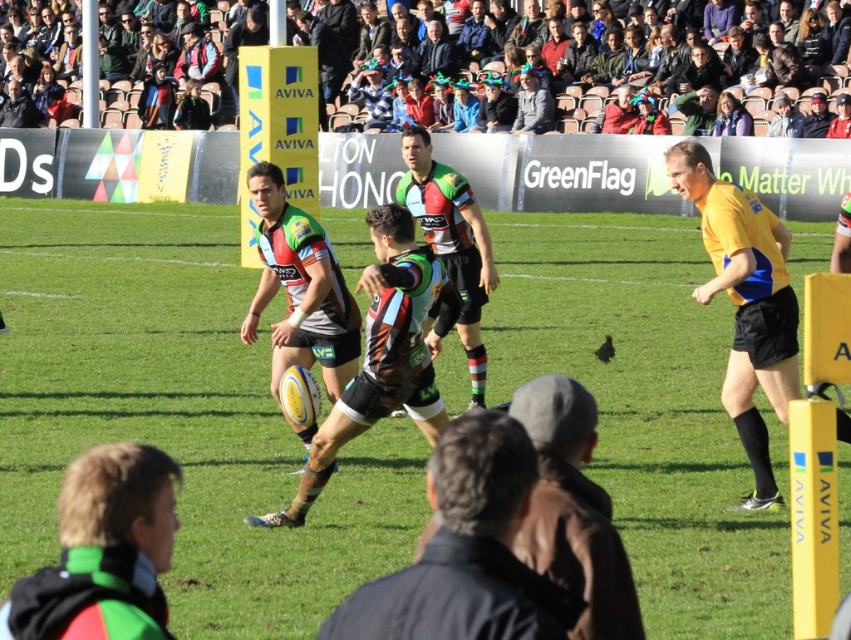
Consider the image. Can you confirm if yellow jersey at right is taller than green jersey at center?

Indeed, yellow jersey at right has a greater height compared to green jersey at center.

Who is taller, yellow jersey at right or green jersey at center?

Standing taller between the two is yellow jersey at right.

Where is `yellow jersey at right`? yellow jersey at right is located at coordinates (745, 304).

Who is positioned more to the right, matte rugby ball at center or yellow jersey at right?

From the viewer's perspective, yellow jersey at right appears more on the right side.

Can you confirm if matte rugby ball at center is positioned to the right of yellow jersey at right?

No, matte rugby ball at center is not to the right of yellow jersey at right.

Locate an element on the screen. The height and width of the screenshot is (640, 851). matte rugby ball at center is located at coordinates (180, 413).

Find the location of a particular element. The image size is (851, 640). matte rugby ball at center is located at coordinates (180, 413).

Who is more forward, (158, 467) or (697, 193)?

Point (158, 467) is in front.

What do you see at coordinates (103, 550) in the screenshot? The width and height of the screenshot is (851, 640). I see `green fabric jacket at lower left` at bounding box center [103, 550].

At what (x,y) coordinates should I click in order to perform the action: click on green fabric jacket at lower left. Please return your answer as a coordinate pair (x, y). This screenshot has height=640, width=851. Looking at the image, I should click on (103, 550).